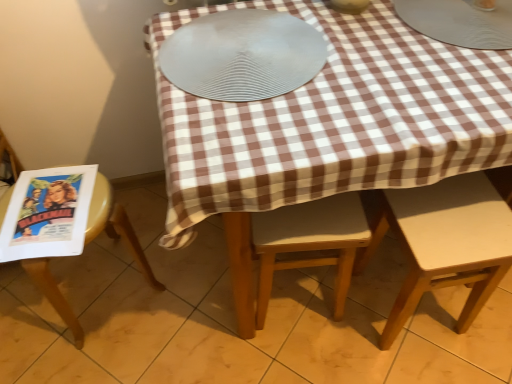
Question: Would you say light brown wooden chair at center, placed as the second chair when sorted from left to right, is outside silver textured platter at center?

Choices:
 (A) yes
 (B) no

Answer: (A)

Question: Does light brown wooden chair at center, arranged as the second chair when viewed from the right, have a lesser width compared to silver textured platter at center?

Choices:
 (A) no
 (B) yes

Answer: (B)

Question: From a real-world perspective, is light brown wooden chair at center, placed as the second chair when sorted from left to right, under silver textured platter at center?

Choices:
 (A) yes
 (B) no

Answer: (A)

Question: Could you tell me if light brown wooden chair at center, placed as the second chair when sorted from left to right, is facing silver textured platter at center?

Choices:
 (A) no
 (B) yes

Answer: (A)

Question: Can you confirm if light brown wooden chair at center, placed as the second chair when sorted from left to right, is smaller than silver textured platter at center?

Choices:
 (A) no
 (B) yes

Answer: (A)

Question: Is metallic silver plate at upper right, the first tableware positioned from the right, situated inside yellow plastic chair at left, acting as the first chair starting from the left, or outside?

Choices:
 (A) outside
 (B) inside

Answer: (A)

Question: Based on their sizes in the image, would you say metallic silver plate at upper right, the 2th tableware positioned from the left, is bigger or smaller than yellow plastic chair at left, marked as the 3th chair in a right-to-left arrangement?

Choices:
 (A) big
 (B) small

Answer: (B)

Question: Is point (420, 14) closer or farther from the camera than point (41, 266)?

Choices:
 (A) farther
 (B) closer

Answer: (A)

Question: From a real-world perspective, relative to yellow plastic chair at left, marked as the 3th chair in a right-to-left arrangement, is metallic silver plate at upper right, the 2th tableware positioned from the left, vertically above or below?

Choices:
 (A) above
 (B) below

Answer: (A)

Question: Is silver textured platter at center inside or outside of light brown wooden chair at center, arranged as the second chair when viewed from the right?

Choices:
 (A) inside
 (B) outside

Answer: (B)

Question: Considering the positions of silver textured platter at center and light brown wooden chair at center, placed as the second chair when sorted from left to right, in the image, is silver textured platter at center taller or shorter than light brown wooden chair at center, placed as the second chair when sorted from left to right,?

Choices:
 (A) tall
 (B) short

Answer: (B)

Question: Is silver textured platter at center bigger or smaller than light brown wooden chair at center, arranged as the second chair when viewed from the right?

Choices:
 (A) big
 (B) small

Answer: (B)

Question: From a real-world perspective, is silver textured platter at center above or below light brown wooden chair at center, placed as the second chair when sorted from left to right?

Choices:
 (A) below
 (B) above

Answer: (B)

Question: Considering the positions of yellow plastic chair at left, acting as the first chair starting from the left, and matte paper comic book at left in the image, is yellow plastic chair at left, acting as the first chair starting from the left, taller or shorter than matte paper comic book at left?

Choices:
 (A) short
 (B) tall

Answer: (B)

Question: Considering their positions, is yellow plastic chair at left, acting as the first chair starting from the left, located in front of or behind matte paper comic book at left?

Choices:
 (A) behind
 (B) front

Answer: (B)